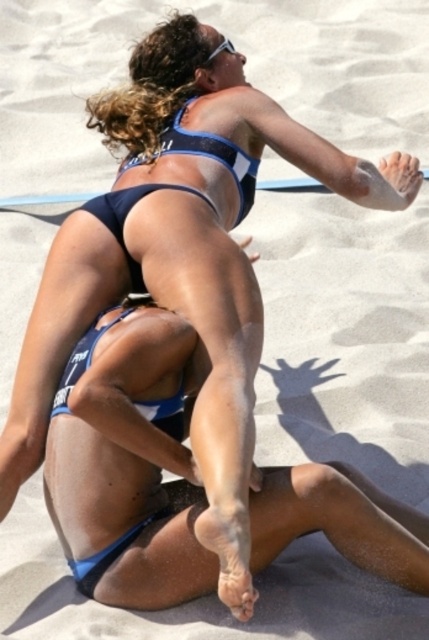
Which is more to the left, matte blue bikini at center or blue matte bikini bottom at center?

Positioned to the left is blue matte bikini bottom at center.

Measure the distance between point (254, 164) and camera.

Point (254, 164) and camera are 4.22 meters apart from each other.

Which is in front, point (166, 188) or point (93, 342)?

Point (93, 342)

Find the location of a particular element. matte blue bikini at center is located at coordinates (211, 156).